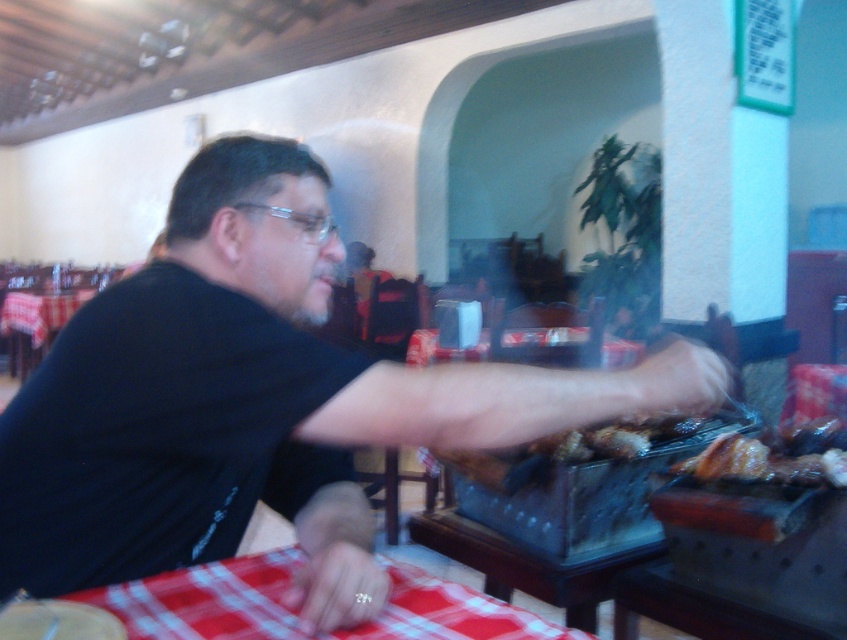
Who is higher up, black matte shirt at center or brown crispy chicken at center?

black matte shirt at center is higher up.

Measure the distance between black matte shirt at center and camera.

A distance of 29.97 inches exists between black matte shirt at center and camera.

Where is `black matte shirt at center`? The image size is (847, 640). black matte shirt at center is located at coordinates (257, 403).

The height and width of the screenshot is (640, 847). Find the location of `black matte shirt at center`. black matte shirt at center is located at coordinates (257, 403).

Between red checkered tablecloth at lower center and red checkered tablecloth at left, which one has less height?

Standing shorter between the two is red checkered tablecloth at lower center.

Identify the location of red checkered tablecloth at lower center. Image resolution: width=847 pixels, height=640 pixels. (206, 600).

How distant is black matte shirt at center from transparent plastic glasses at center?

A distance of 27.40 centimeters exists between black matte shirt at center and transparent plastic glasses at center.

Does black matte shirt at center have a lesser height compared to transparent plastic glasses at center?

No.

Locate an element on the screen. black matte shirt at center is located at coordinates (257, 403).